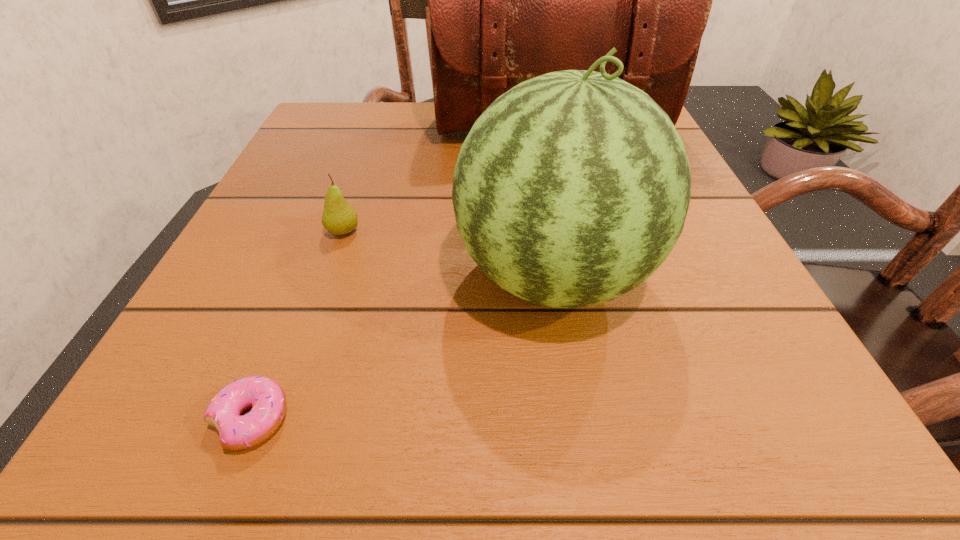
Identify the location of satchel. This screenshot has height=540, width=960. (509, 0).

The width and height of the screenshot is (960, 540). I want to click on watermelon, so click(572, 188).

Find the location of a particular element. pear is located at coordinates (339, 217).

Where is `the shortest object`? the shortest object is located at coordinates (267, 399).

The width and height of the screenshot is (960, 540). What are the coordinates of `doughnut` in the screenshot? It's located at (267, 399).

Where is `free space located 0.360m on the front-facing side of the farthest object`? free space located 0.360m on the front-facing side of the farthest object is located at coordinates (588, 298).

In order to click on vacant space located on the left of the watermelon in this screenshot , I will do `click(351, 275)`.

Where is `free space located on the front of the third tallest object`? Image resolution: width=960 pixels, height=540 pixels. free space located on the front of the third tallest object is located at coordinates (326, 284).

Identify the location of free space located on the right of the shortest object. (549, 419).

The image size is (960, 540). In order to click on object that is at the far edge in this screenshot , I will do `click(509, 0)`.